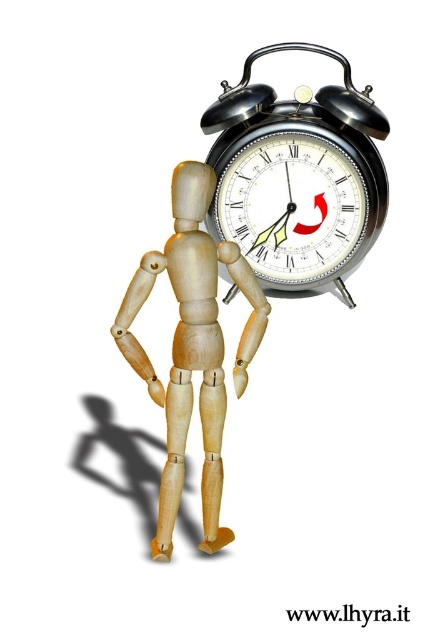
Question: Which point is farther from the camera taking this photo?

Choices:
 (A) (339, 150)
 (B) (338, 237)

Answer: (B)

Question: Is black metal alarm clock at upper right bigger than wooden mannequin at center?

Choices:
 (A) no
 (B) yes

Answer: (B)

Question: Considering the relative positions of black metal alarm clock at upper right and wooden mannequin at center in the image provided, where is black metal alarm clock at upper right located with respect to wooden mannequin at center?

Choices:
 (A) above
 (B) below

Answer: (A)

Question: Is wooden mannequin at center to the left of metallic silver clock at center from the viewer's perspective?

Choices:
 (A) no
 (B) yes

Answer: (B)

Question: Which point is farther from the camera taking this photo?

Choices:
 (A) (229, 186)
 (B) (329, 253)

Answer: (B)

Question: Which object is the closest to the black metal alarm clock at upper right?

Choices:
 (A) wooden mannequin at center
 (B) metallic silver clock at center

Answer: (B)